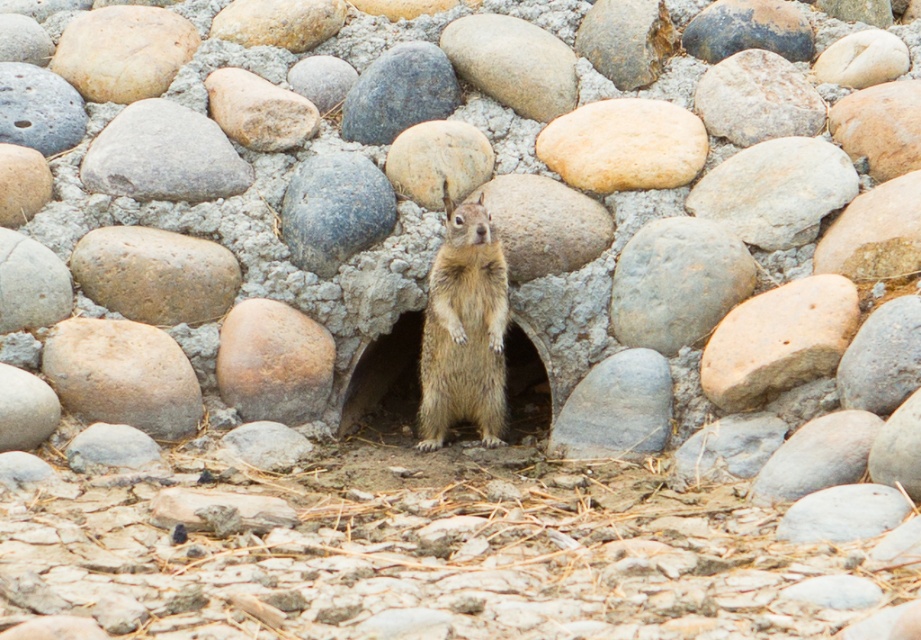
Is brown furry squirrel at center positioned in front of smooth beige rock at center?

Yes, brown furry squirrel at center is in front of smooth beige rock at center.

Does point (499, 401) come in front of point (586, 124)?

That is True.

At what (x,y) coordinates should I click in order to perform the action: click on brown furry squirrel at center. Please return your answer as a coordinate pair (x, y). The height and width of the screenshot is (640, 921). Looking at the image, I should click on (464, 330).

Which of these two, brown rough rock at center or smooth gray rock at center, stands shorter?

Standing shorter between the two is brown rough rock at center.

Between point (304, 368) and point (309, 260), which one is positioned in front?

Positioned in front is point (304, 368).

You are a GUI agent. You are given a task and a screenshot of the screen. Output one action in this format:
    pyautogui.click(x=<x>, y=<y>)
    Task: Click on the brown rough rock at center
    
    Given the screenshot: What is the action you would take?
    pyautogui.click(x=274, y=362)

Is point (127, 333) closer to camera compared to point (193, 120)?

That is True.

Is smooth beige rock at lower left closer to camera compared to gray matte rock at upper left?

Yes, smooth beige rock at lower left is closer to the viewer.

Locate an element on the screen. The image size is (921, 640). smooth beige rock at lower left is located at coordinates (122, 376).